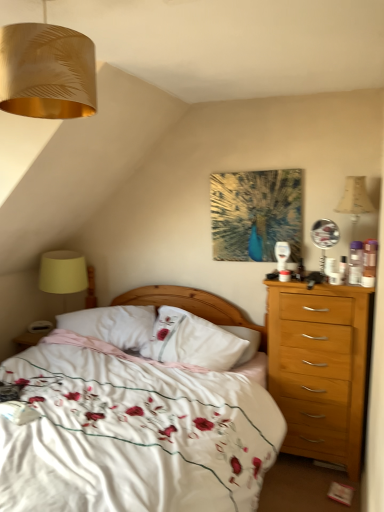
Question: From the image's perspective, is white floral duvet at center positioned above or below gold metallic lampshade at upper left?

Choices:
 (A) above
 (B) below

Answer: (B)

Question: Which is correct: white floral duvet at center is inside gold metallic lampshade at upper left, or outside of it?

Choices:
 (A) outside
 (B) inside

Answer: (A)

Question: Based on their relative distances, which object is farther from the white soft pillow at center, the 2th pillow when ordered from right to left?

Choices:
 (A) white soft pillow at center, arranged as the second pillow when viewed from the left
 (B) gold metallic lampshade at upper left
 (C) yellow fabric lampshade at left
 (D) white floral duvet at center

Answer: (B)

Question: Estimate the real-world distances between objects in this image. Which object is closer to the yellow fabric lampshade at left?

Choices:
 (A) white soft pillow at center, arranged as the second pillow when viewed from the left
 (B) gold metallic lampshade at upper left
 (C) white soft pillow at center, the 2th pillow when ordered from right to left
 (D) white floral duvet at center

Answer: (C)